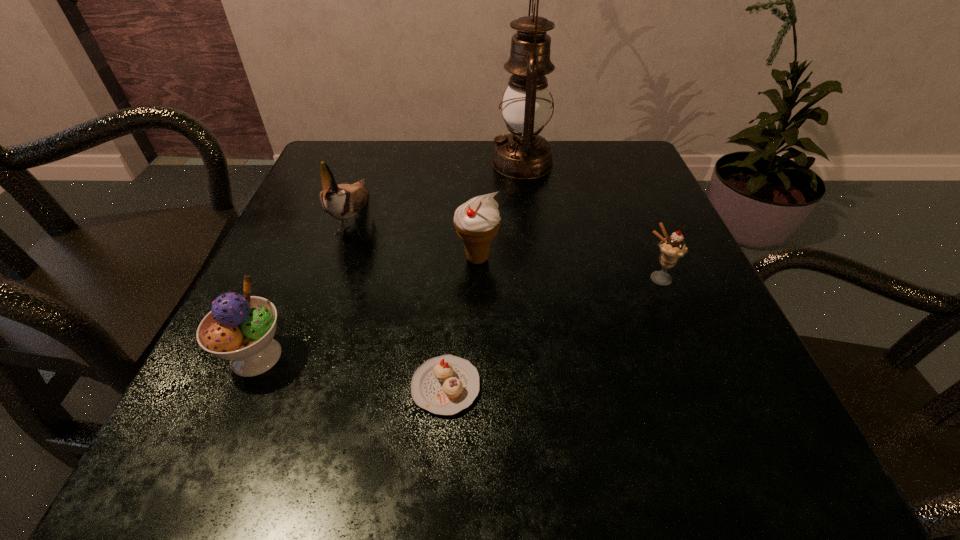
I want to click on vacant space situated on the right of the nearest icecream, so click(483, 356).

Identify the location of vacant space located on the back of the rightmost object. (614, 176).

You are a GUI agent. You are given a task and a screenshot of the screen. Output one action in this format:
    pyautogui.click(x=<x>, y=<y>)
    Task: Click on the vacant space located on the front of the shortest object
    Image resolution: width=960 pixels, height=540 pixels.
    Given the screenshot: What is the action you would take?
    (440, 484)

This screenshot has height=540, width=960. In order to click on oil lamp that is positioned at the far edge in this screenshot , I will do `click(523, 154)`.

Find the location of a particular element. The width and height of the screenshot is (960, 540). bird that is at the far edge is located at coordinates (343, 201).

Where is `object located in the near edge section of the desktop`? The width and height of the screenshot is (960, 540). object located in the near edge section of the desktop is located at coordinates (444, 385).

Find the location of `bird that is at the left edge`. bird that is at the left edge is located at coordinates (x=343, y=201).

Where is `icecream that is positioned at the left edge`? icecream that is positioned at the left edge is located at coordinates (240, 328).

Find the location of a particular element. The width and height of the screenshot is (960, 540). object present at the right edge is located at coordinates [672, 248].

Find the location of a particular element. object situated at the far left corner is located at coordinates (343, 201).